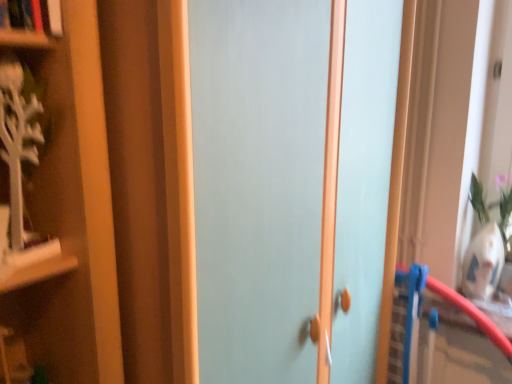
Locate an element on the screen. The width and height of the screenshot is (512, 384). matte light blue door at center is located at coordinates (258, 183).

This screenshot has width=512, height=384. What do you see at coordinates (258, 183) in the screenshot?
I see `matte light blue door at center` at bounding box center [258, 183].

This screenshot has width=512, height=384. Describe the element at coordinates (36, 15) in the screenshot. I see `hardcover book at upper left` at that location.

The image size is (512, 384). I want to click on hardcover book at upper left, so click(36, 15).

Find the location of a particular element. The height and width of the screenshot is (384, 512). matte light blue door at center is located at coordinates (258, 183).

Does matte light blue door at center appear on the right side of hardcover book at upper left?

Indeed, matte light blue door at center is positioned on the right side of hardcover book at upper left.

Relative to hardcover book at upper left, is matte light blue door at center in front or behind?

In the image, matte light blue door at center appears in front of hardcover book at upper left.

Is point (277, 331) behind point (38, 24)?

Yes, point (277, 331) is behind point (38, 24).

From the image's perspective, is matte light blue door at center on hardcover book at upper left?

No, from the image's perspective, matte light blue door at center is not over hardcover book at upper left.

From a real-world perspective, is matte light blue door at center under hardcover book at upper left?

Yes, from a real-world perspective, matte light blue door at center is under hardcover book at upper left.

Which of these two, matte light blue door at center or hardcover book at upper left, is wider?

With larger width is matte light blue door at center.

Considering the sizes of objects matte light blue door at center and hardcover book at upper left in the image provided, who is taller, matte light blue door at center or hardcover book at upper left?

Standing taller between the two is matte light blue door at center.

Is matte light blue door at center bigger than hardcover book at upper left?

Yes, matte light blue door at center is bigger than hardcover book at upper left.

Is matte light blue door at center inside the boundaries of hardcover book at upper left, or outside?

matte light blue door at center exists outside the volume of hardcover book at upper left.

Is matte light blue door at center positioned far away from hardcover book at upper left?

No, there isn't a large distance between matte light blue door at center and hardcover book at upper left.

Is matte light blue door at center turned away from hardcover book at upper left?

No, hardcover book at upper left is not at the back of matte light blue door at center.

How far apart are matte light blue door at center and hardcover book at upper left?

matte light blue door at center is 50.95 centimeters from hardcover book at upper left.

The width and height of the screenshot is (512, 384). I want to click on book lying behind the matte light blue door at center, so click(x=36, y=15).

Considering the relative positions of hardcover book at upper left and matte light blue door at center in the image provided, is hardcover book at upper left to the right of matte light blue door at center from the viewer's perspective?

Incorrect, hardcover book at upper left is not on the right side of matte light blue door at center.

Does hardcover book at upper left come behind matte light blue door at center?

Yes, it is behind matte light blue door at center.

Which is behind, point (17, 3) or point (259, 346)?

The point (259, 346) is more distant.

From the image's perspective, is hardcover book at upper left located above matte light blue door at center?

Correct, hardcover book at upper left appears higher than matte light blue door at center in the image.

From a real-world perspective, is hardcover book at upper left on top of matte light blue door at center?

Yes, from a real-world perspective, hardcover book at upper left is on top of matte light blue door at center.

Is hardcover book at upper left wider or thinner than matte light blue door at center?

hardcover book at upper left is thinner than matte light blue door at center.

Consider the image. Which of these two, hardcover book at upper left or matte light blue door at center, stands shorter?

With less height is hardcover book at upper left.

Does hardcover book at upper left have a larger size compared to matte light blue door at center?

Incorrect, hardcover book at upper left is not larger than matte light blue door at center.

Based on the photo, is hardcover book at upper left inside or outside of matte light blue door at center?

hardcover book at upper left is spatially situated outside matte light blue door at center.

Is hardcover book at upper left far from matte light blue door at center?

No, there isn't a large distance between hardcover book at upper left and matte light blue door at center.

Is hardcover book at upper left facing towards matte light blue door at center?

No, hardcover book at upper left is not turned towards matte light blue door at center.

Can you tell me how much hardcover book at upper left and matte light blue door at center differ in facing direction?

There is a 4.21-degree angle between the facing directions of hardcover book at upper left and matte light blue door at center.

I want to click on door located underneath the hardcover book at upper left (from a real-world perspective), so click(258, 183).

Find the location of a particular element. door below the hardcover book at upper left (from the image's perspective) is located at coordinates (258, 183).

You are a GUI agent. You are given a task and a screenshot of the screen. Output one action in this format:
    pyautogui.click(x=<x>, y=<y>)
    Task: Click on the door below the hardcover book at upper left (from a real-world perspective)
    Image resolution: width=512 pixels, height=384 pixels.
    Given the screenshot: What is the action you would take?
    pyautogui.click(x=258, y=183)